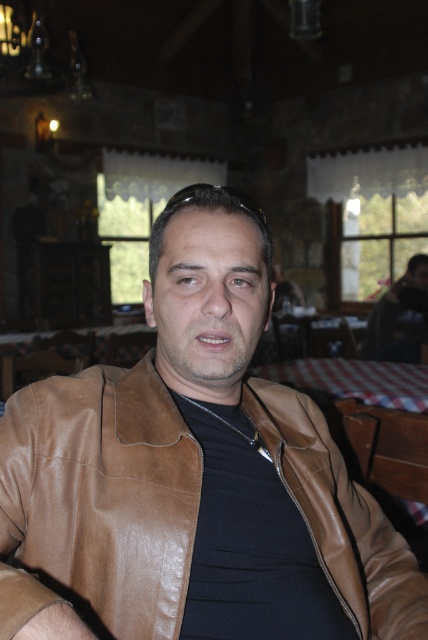
In the scene shown: Does brown leather jacket at center appear on the right side of dark green shirt at right?

In fact, brown leather jacket at center is to the left of dark green shirt at right.

How much distance is there between brown leather jacket at center and dark green shirt at right?

A distance of 10.65 feet exists between brown leather jacket at center and dark green shirt at right.

Where is `brown leather jacket at center`? brown leather jacket at center is located at coordinates (98, 500).

The image size is (428, 640). What are the coordinates of `brown leather jacket at center` in the screenshot? It's located at (98, 500).